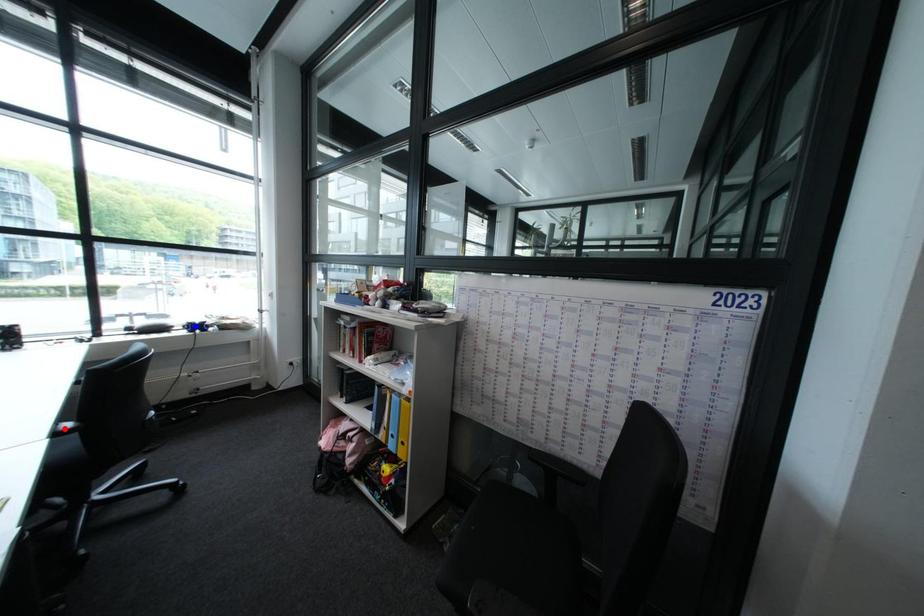
Question: Which of the two points in the image is closer to the camera?

Choices:
 (A) Blue point is closer.
 (B) Red point is closer.

Answer: (B)